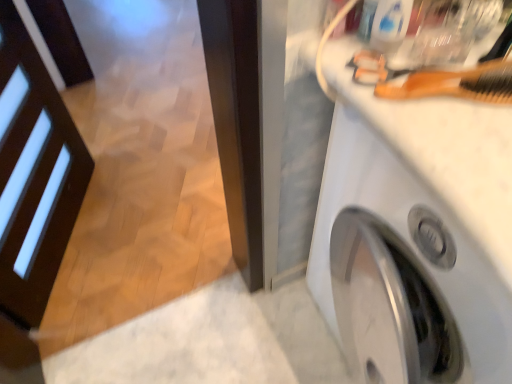
Question: Considering the positions of wooden comb at upper right and white glossy washing machine at upper right in the image, is wooden comb at upper right taller or shorter than white glossy washing machine at upper right?

Choices:
 (A) short
 (B) tall

Answer: (A)

Question: Is point (415, 71) positioned closer to the camera than point (434, 263)?

Choices:
 (A) closer
 (B) farther

Answer: (B)

Question: From a real-world perspective, is wooden comb at upper right above or below white glossy washing machine at upper right?

Choices:
 (A) below
 (B) above

Answer: (B)

Question: From their relative heights in the image, would you say white glossy washing machine at upper right is taller or shorter than wooden comb at upper right?

Choices:
 (A) tall
 (B) short

Answer: (A)

Question: Is white glossy washing machine at upper right situated inside wooden comb at upper right or outside?

Choices:
 (A) outside
 (B) inside

Answer: (A)

Question: From the image's perspective, is white glossy washing machine at upper right positioned above or below wooden comb at upper right?

Choices:
 (A) below
 (B) above

Answer: (A)

Question: Is point (450, 243) closer or farther from the camera than point (507, 100)?

Choices:
 (A) closer
 (B) farther

Answer: (B)